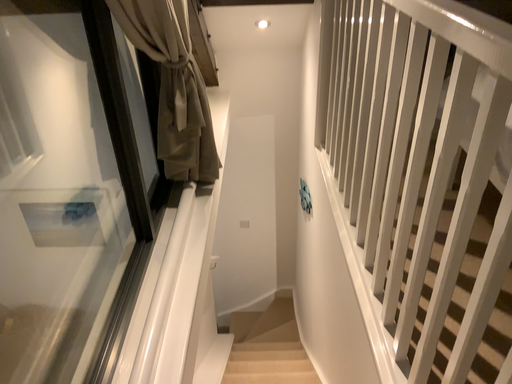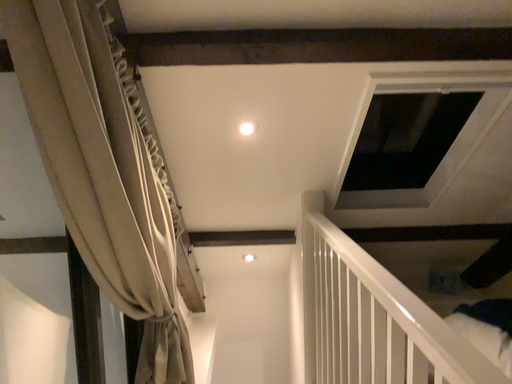
Question: Which way did the camera rotate in the video?

Choices:
 (A) rotated upward
 (B) rotated downward

Answer: (A)